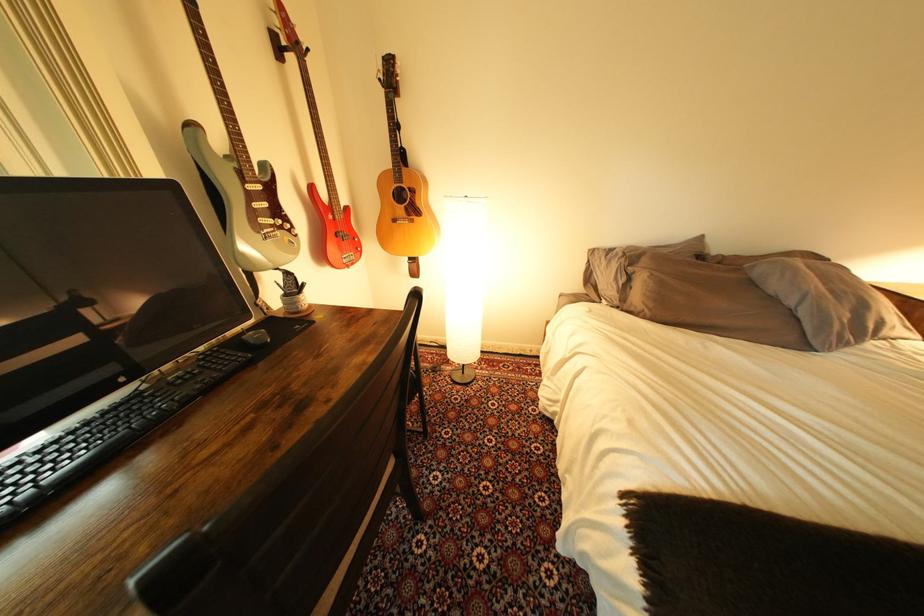
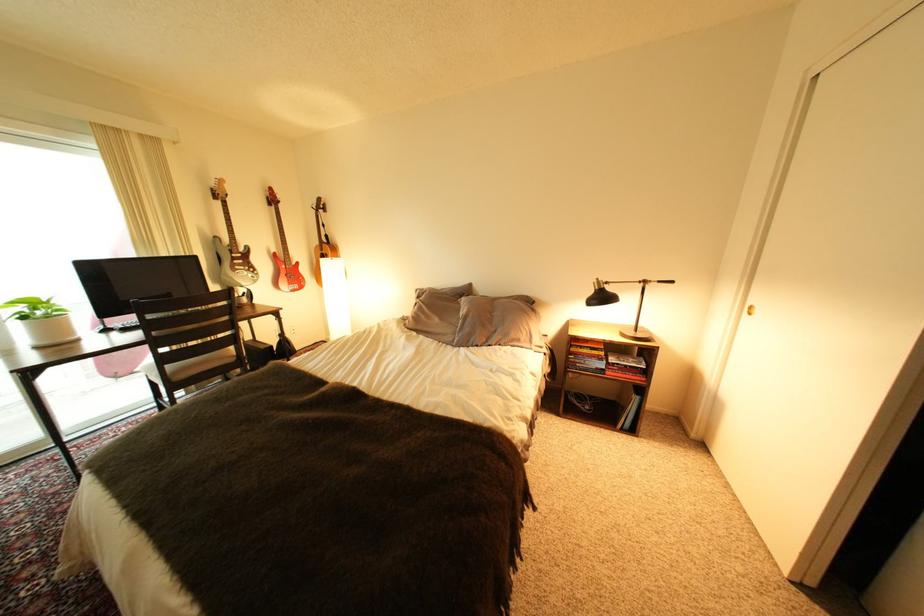
What movement of the cameraman would produce the second image?

The cameraman walked toward right, backward.